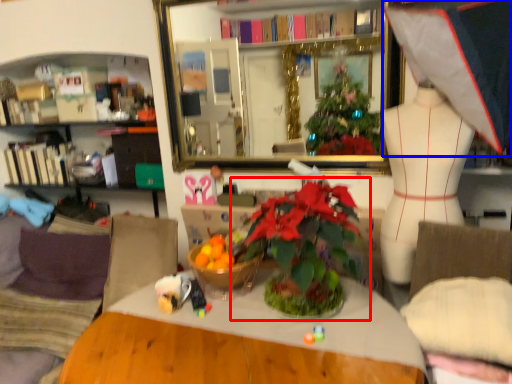
Question: Which point is closer to the camera, houseplant (highlighted by a red box) or clothing (highlighted by a blue box)?

Choices:
 (A) houseplant
 (B) clothing

Answer: (B)